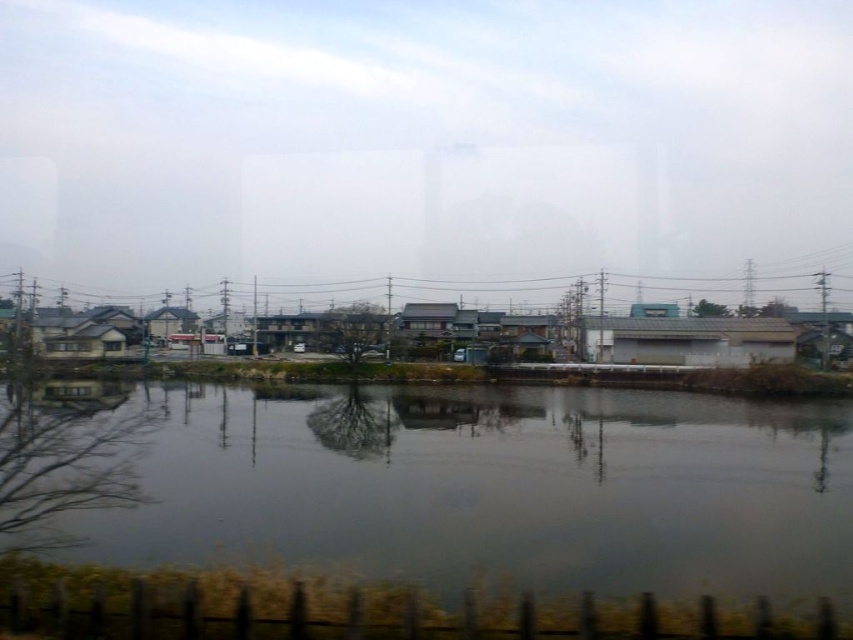
Can you confirm if dark gray water at center is bigger than green corrugated metal power line at center?

No.

Between dark gray water at center and green corrugated metal power line at center, which one is positioned lower?

dark gray water at center

The image size is (853, 640). Identify the location of dark gray water at center. (491, 486).